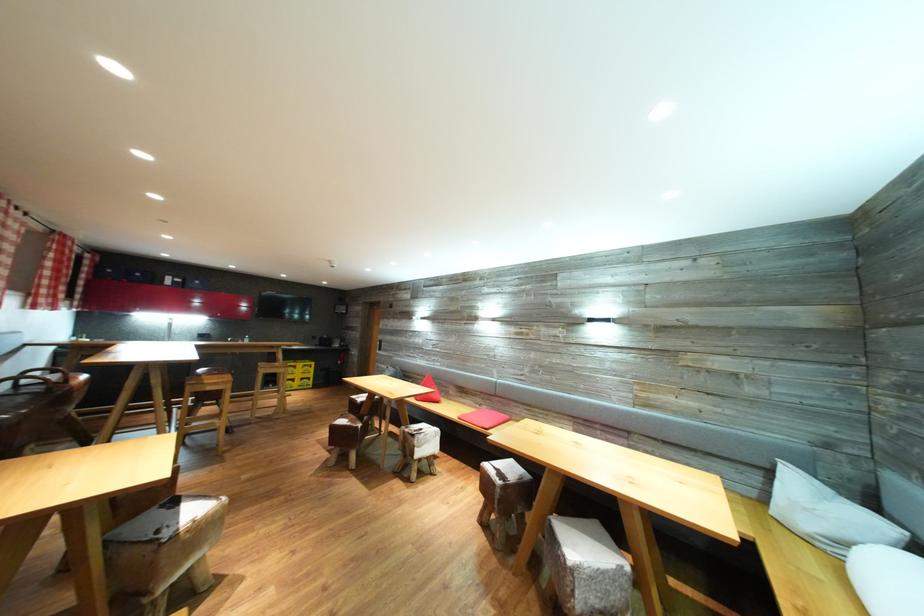
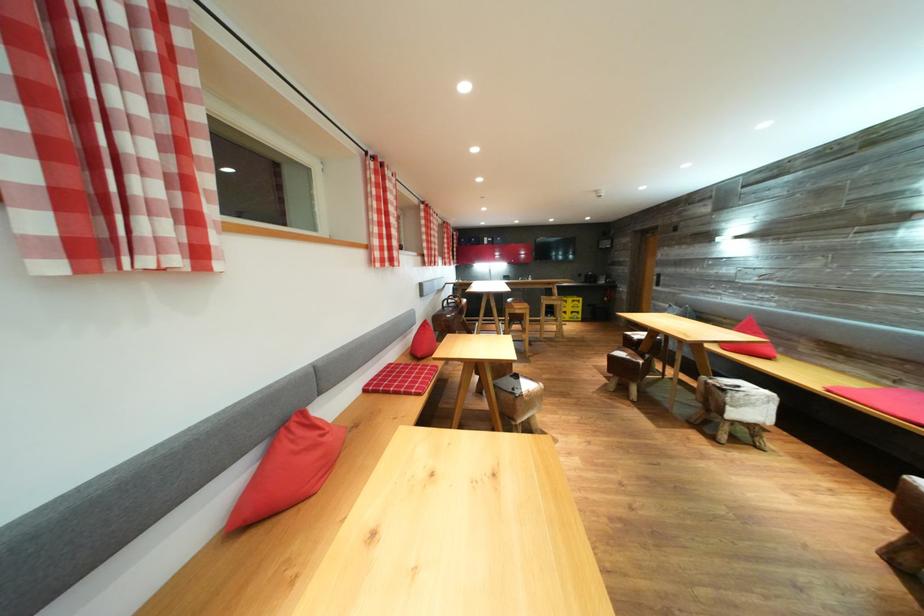
In the second image, find the point that corresponds to point (428, 435) in the first image.

(745, 392)